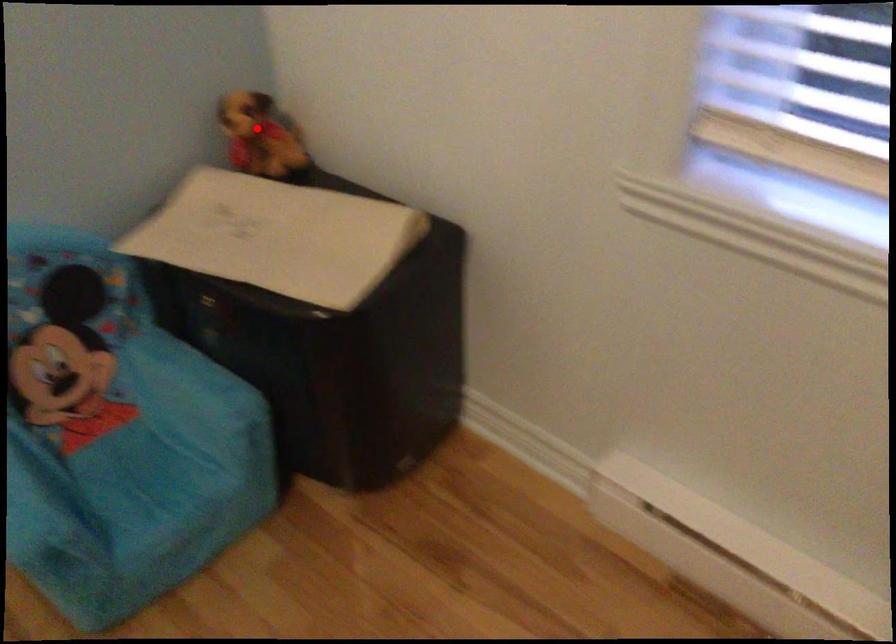
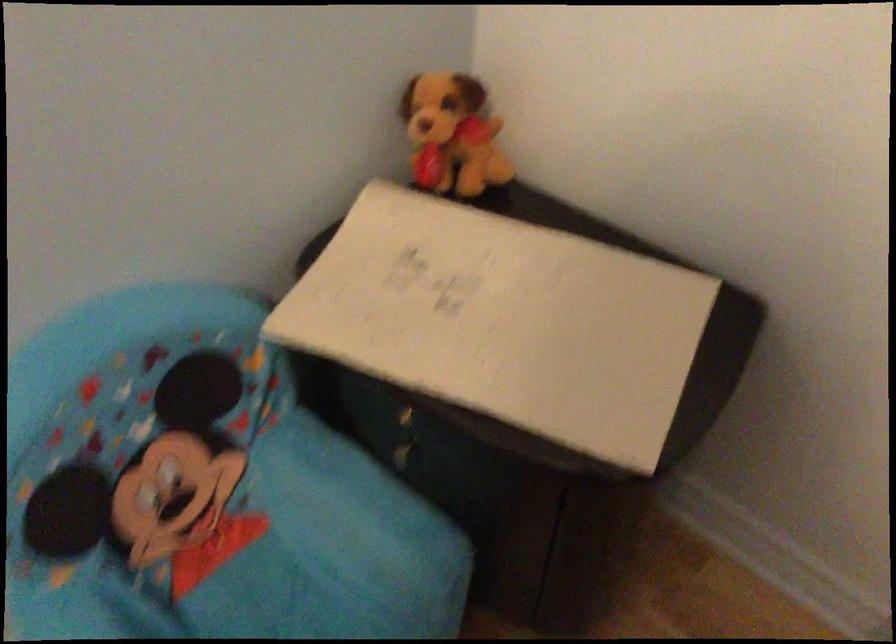
Where in the second image is the point corresponding to the highlighted location from the first image?

(452, 134)